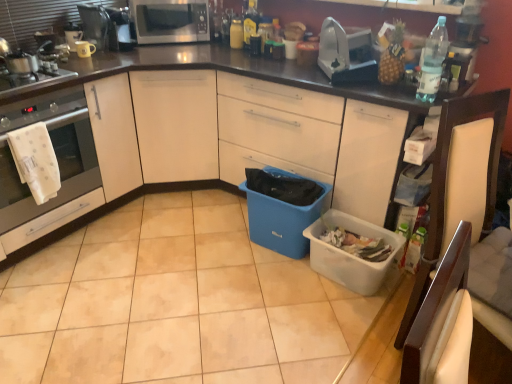
Find the location of `free space above blue plastic bin at center, the second storage box positioned from the right (from a real-world perspective)`. free space above blue plastic bin at center, the second storage box positioned from the right (from a real-world perspective) is located at coordinates (296, 182).